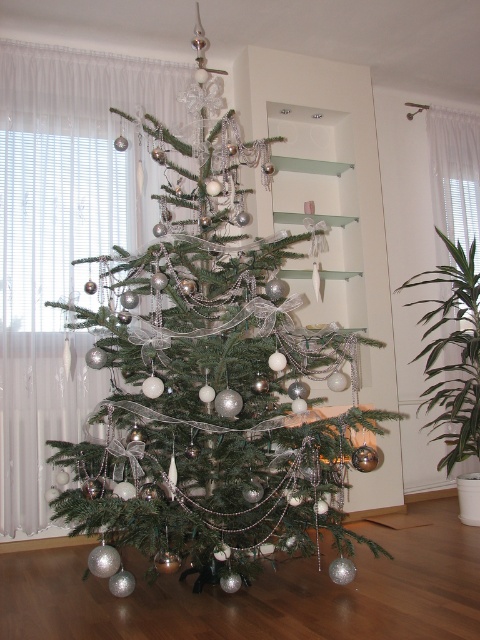
You are standing in front of the Christmas tree and want to place a gift under it. There are two points marked on the floor where you can place it. The first point is at coordinates point (267, 410) and the second is at point (457, 355). Which point is closer to you?

Point (267, 410) is in front of point (457, 355), so the first point is closer to you.

You are standing in front of the Christmas tree and want to place a gift at point (196, 554). If the gift requires a space that is at least 5 feet away from the viewer, will this point be suitable?

The distance of point (196, 554) from viewer is 7.13 feet, which is more than 5 feet, so the point is suitable for placing the gift.

You are a guest at a Christmas party and want to place a small gift under the tree. You see the shiny silver ornaments at center and the green leafy plant at right. Which object is located higher up on the Christmas tree?

The shiny silver ornaments at center are positioned over the green leafy plant at right, so they are higher up on the Christmas tree.